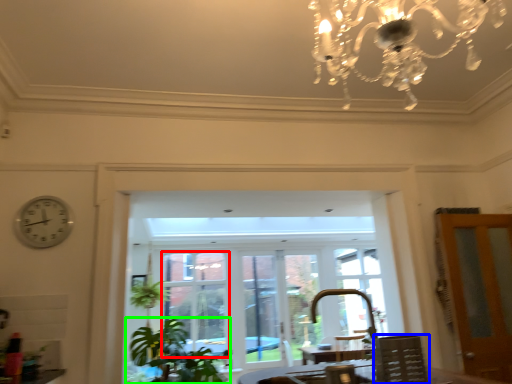
Question: Estimate the real-world distances between objects in this image. Which object is closer to window (highlighted by a red box), chair (highlighted by a blue box) or houseplant (highlighted by a green box)?

Choices:
 (A) chair
 (B) houseplant

Answer: (B)